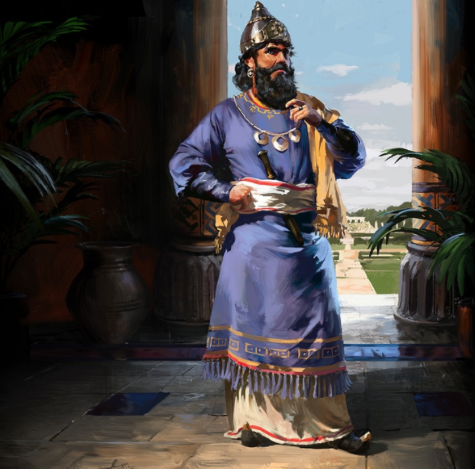
Image resolution: width=475 pixels, height=469 pixels. What are the coordinates of `knife handle` in the screenshot? It's located at (268, 167).